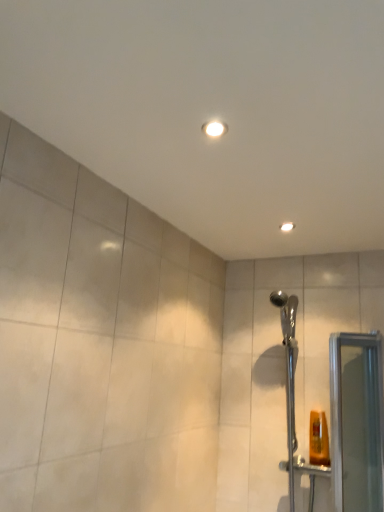
Question: From a real-world perspective, is clear glass screen door at right positioned above or below chrome metallic shower head at right?

Choices:
 (A) above
 (B) below

Answer: (B)

Question: Looking at the image, does clear glass screen door at right seem bigger or smaller compared to chrome metallic shower head at right?

Choices:
 (A) big
 (B) small

Answer: (B)

Question: Considering the real-world distances, which object is closest to the clear glass screen door at right?

Choices:
 (A) chrome metallic shower head at right
 (B) matte white light fixture at upper center

Answer: (A)

Question: Which object is the farthest from the clear glass screen door at right?

Choices:
 (A) matte white light fixture at upper center
 (B) chrome metallic shower head at right

Answer: (A)